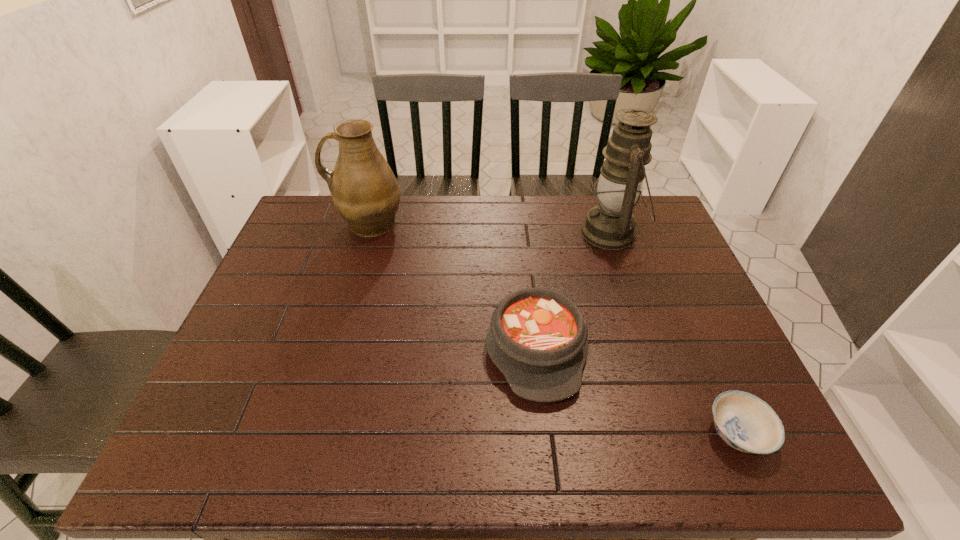
Where is `the tallest object`? This screenshot has width=960, height=540. the tallest object is located at coordinates (611, 225).

The height and width of the screenshot is (540, 960). In order to click on the leftmost object in this screenshot , I will do `click(365, 191)`.

I want to click on pitcher, so click(365, 191).

Locate an element on the screen. The width and height of the screenshot is (960, 540). casserole is located at coordinates (537, 338).

The height and width of the screenshot is (540, 960). I want to click on the third object from right to left, so (x=537, y=338).

Locate an element on the screen. bowl is located at coordinates (745, 422).

Where is `blank space located 0.170m on the left of the oil lamp`? The width and height of the screenshot is (960, 540). blank space located 0.170m on the left of the oil lamp is located at coordinates (527, 233).

Identify the location of free space located on the handle side of the third shortest object. This screenshot has height=540, width=960. (315, 223).

At what (x,y) coordinates should I click in order to perform the action: click on vacant space located on the right of the second object from left to right. Please return your answer as a coordinate pair (x, y). This screenshot has height=540, width=960. Looking at the image, I should click on pos(627,348).

At what (x,y) coordinates should I click in order to perform the action: click on vacant space situated 0.400m on the back of the shortest object. Please return your answer as a coordinate pair (x, y). The height and width of the screenshot is (540, 960). Looking at the image, I should click on (669, 278).